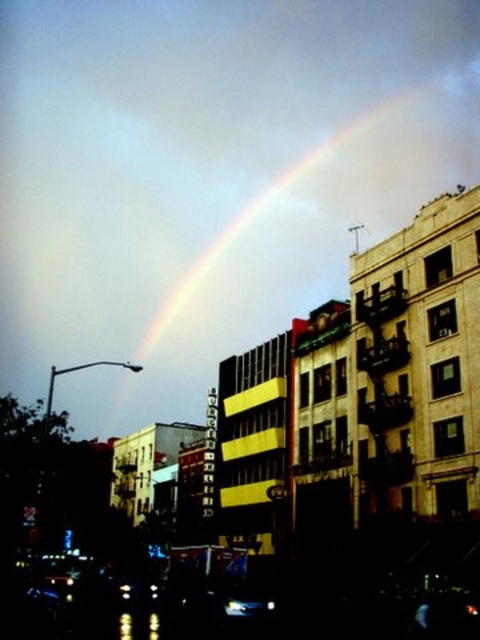
You are standing in the urban scene and want to know how far the point at coordinates (367, 156) is from you. Can you determine the distance?

The distance between point (367, 156) and the viewer is 1190.72 feet.

Looking at this image, you are an architect designing a new skyscraper in this city. You want to ensure the building has a window that always faces the rainbow at upper center. Given the rainbow is located at coordinates approximately 0.392 on the x and 0.594 on the y axis, what are the coordinates you should use to align the window?

The rainbow at upper center is located at coordinates approximately 0.392 on the x and 0.594 on the y axis, so the window should be aligned to those coordinates to ensure it faces the rainbow at upper center.